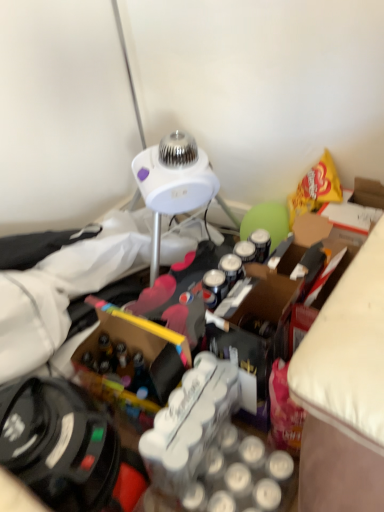
What is the approximate width of white plastic lamp at upper center?

The width of white plastic lamp at upper center is 12.89 inches.

The height and width of the screenshot is (512, 384). Describe the element at coordinates (65, 288) in the screenshot. I see `white plastic lamp at upper center` at that location.

Where is `white plastic lamp at upper center`? white plastic lamp at upper center is located at coordinates (65, 288).

Locate an element on the screen. Image resolution: width=384 pixels, height=512 pixels. white plastic lamp at upper center is located at coordinates click(65, 288).